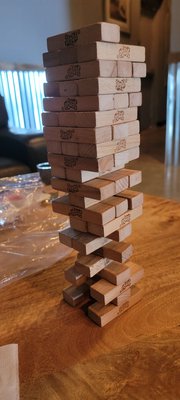
The width and height of the screenshot is (180, 400). Find the location of `woodgrain pattern`. woodgrain pattern is located at coordinates (158, 311), (135, 374), (66, 351).